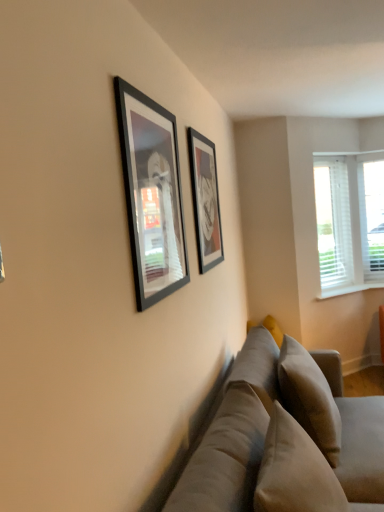
What is the approximate width of matte black picture frame at upper center, which appears as the first picture frame when viewed from the front?

matte black picture frame at upper center, which appears as the first picture frame when viewed from the front, is 1.27 inches wide.

The image size is (384, 512). Find the location of `white plastic blinds at right`. white plastic blinds at right is located at coordinates (333, 223).

Locate an element on the screen. This screenshot has width=384, height=512. soft beige pillow at lower right is located at coordinates coord(309,398).

In order to face soft beige pillow at lower right, should I rotate leftwards or rightwards?

To face it directly, rotate right by 15.220 degrees.

Where is `matte black picture frame at upper center, the 2th picture frame from the right`? This screenshot has height=512, width=384. matte black picture frame at upper center, the 2th picture frame from the right is located at coordinates (152, 194).

Is matte black picture frame at center, which is counted as the first picture frame, starting from the back, shorter than soft beige pillow at lower right?

No, matte black picture frame at center, which is counted as the first picture frame, starting from the back, is not shorter than soft beige pillow at lower right.

Can you confirm if matte black picture frame at center, the 2th picture frame positioned from the front, is wider than soft beige pillow at lower right?

Incorrect, the width of matte black picture frame at center, the 2th picture frame positioned from the front, does not surpass that of soft beige pillow at lower right.

Locate an element on the screen. This screenshot has height=512, width=384. pillow on the right of matte black picture frame at center, which is the 2th picture frame in left-to-right order is located at coordinates (309, 398).

Is matte black picture frame at upper center, which ranks as the 2th picture frame in back-to-front order, at the back of soft beige pillow at lower right?

soft beige pillow at lower right is not turned away from matte black picture frame at upper center, which ranks as the 2th picture frame in back-to-front order.

Considering the relative positions of soft beige pillow at lower right and matte black picture frame at upper center, the 2th picture frame from the right, in the image provided, is soft beige pillow at lower right to the left of matte black picture frame at upper center, the 2th picture frame from the right, from the viewer's perspective?

Incorrect, soft beige pillow at lower right is not on the left side of matte black picture frame at upper center, the 2th picture frame from the right.

From a real-world perspective, between soft beige pillow at lower right and matte black picture frame at upper center, which appears as the first picture frame when viewed from the front, who is vertically lower?

From a 3D spatial view, soft beige pillow at lower right is below.

Is soft beige pillow at lower right outside of matte black picture frame at upper center, which ranks as the 2th picture frame in back-to-front order?

Yes, soft beige pillow at lower right is located beyond the bounds of matte black picture frame at upper center, which ranks as the 2th picture frame in back-to-front order.

Is soft beige fabric couch at lower right inside the boundaries of white plastic window sill at right, or outside?

soft beige fabric couch at lower right is outside white plastic window sill at right.

From the picture: Considering the sizes of objects soft beige fabric couch at lower right and white plastic window sill at right in the image provided, who is thinner, soft beige fabric couch at lower right or white plastic window sill at right?

white plastic window sill at right is thinner.

From a real-world perspective, is soft beige fabric couch at lower right beneath white plastic window sill at right?

Yes, from a real-world perspective, soft beige fabric couch at lower right is under white plastic window sill at right.

In order to click on studio couch on the left of white plastic window sill at right in this screenshot , I will do point(286,438).

Is white plastic blinds at right inside the boundaries of soft beige fabric couch at lower right, or outside?

white plastic blinds at right is located beyond the bounds of soft beige fabric couch at lower right.

Would you say white plastic blinds at right is a long distance from soft beige fabric couch at lower right?

Yes, white plastic blinds at right and soft beige fabric couch at lower right are quite far apart.

Who is taller, white plastic blinds at right or soft beige fabric couch at lower right?

white plastic blinds at right.

Between white plastic blinds at right and soft beige fabric couch at lower right, which one appears on the right side from the viewer's perspective?

white plastic blinds at right.

Considering the positions of objects white plastic window sill at right and white plastic blinds at right in the image provided, who is in front, white plastic window sill at right or white plastic blinds at right?

white plastic window sill at right is closer to the camera.

Could you tell me if white plastic window sill at right is facing white plastic blinds at right?

No, white plastic window sill at right does not turn towards white plastic blinds at right.

Where is `window screen that is above the white plastic window sill at right (from the image's perspective)`? window screen that is above the white plastic window sill at right (from the image's perspective) is located at coordinates (333, 223).

Considering the positions of points (317, 197) and (294, 340), is point (317, 197) farther from camera compared to point (294, 340)?

Yes.

You are a GUI agent. You are given a task and a screenshot of the screen. Output one action in this format:
    pyautogui.click(x=<x>, y=<y>)
    Task: Click on the window screen above the soft beige pillow at lower right (from the image's perspective)
    The width and height of the screenshot is (384, 512).
    Given the screenshot: What is the action you would take?
    pyautogui.click(x=333, y=223)

Would you say white plastic blinds at right is outside soft beige pillow at lower right?

Yes, white plastic blinds at right is outside of soft beige pillow at lower right.

Considering the relative positions of white plastic blinds at right and soft beige pillow at lower right in the image provided, is white plastic blinds at right to the right of soft beige pillow at lower right from the viewer's perspective?

Yes.

Does soft beige pillow at lower right have a smaller size compared to matte black picture frame at center, which is the 2th picture frame in left-to-right order?

Actually, soft beige pillow at lower right might be larger than matte black picture frame at center, which is the 2th picture frame in left-to-right order.

Based on the photo, is soft beige pillow at lower right wider or thinner than matte black picture frame at center, arranged as the 1th picture frame when viewed from the right?

soft beige pillow at lower right is wider than matte black picture frame at center, arranged as the 1th picture frame when viewed from the right.

Can we say soft beige pillow at lower right lies outside matte black picture frame at center, arranged as the 1th picture frame when viewed from the right?

That's correct, soft beige pillow at lower right is outside of matte black picture frame at center, arranged as the 1th picture frame when viewed from the right.

Locate an element on the screen. The image size is (384, 512). pillow located in front of the matte black picture frame at center, which is counted as the first picture frame, starting from the back is located at coordinates (309, 398).

This screenshot has height=512, width=384. Identify the location of pillow below the matte black picture frame at upper center, which appears as the first picture frame when viewed from the front (from a real-world perspective). (309, 398).

Estimate the real-world distances between objects in this image. Which object is closer to white plastic window sill at right, soft beige fabric couch at lower right or white plastic blinds at right?

Among the two, white plastic blinds at right is located nearer to white plastic window sill at right.

Estimate the real-world distances between objects in this image. Which object is further from matte black picture frame at center, which is the 2th picture frame in left-to-right order, white plastic blinds at right or matte black picture frame at upper center, the 2th picture frame from the right?

white plastic blinds at right.

Considering their positions, is matte black picture frame at center, arranged as the 1th picture frame when viewed from the right, positioned closer to white plastic window sill at right than matte black picture frame at upper center, which is the 1th picture frame in left-to-right order?

The object closer to white plastic window sill at right is matte black picture frame at center, arranged as the 1th picture frame when viewed from the right.

Looking at the image, which one is located closer to white plastic window sill at right, soft beige fabric couch at lower right or soft beige pillow at lower right?

soft beige pillow at lower right is closer to white plastic window sill at right.

When comparing their distances from matte black picture frame at upper center, which appears as the first picture frame when viewed from the front, does soft beige pillow at lower right or white plastic blinds at right seem closer?

soft beige pillow at lower right.

Based on their spatial positions, is soft beige fabric couch at lower right or white plastic window sill at right further from white plastic blinds at right?

Based on the image, soft beige fabric couch at lower right appears to be further to white plastic blinds at right.

Looking at the image, which one is located closer to soft beige fabric couch at lower right, soft beige pillow at lower right or white plastic blinds at right?

soft beige pillow at lower right.

Looking at the image, which one is located further to white plastic window sill at right, matte black picture frame at upper center, which appears as the first picture frame when viewed from the front, or soft beige pillow at lower right?

matte black picture frame at upper center, which appears as the first picture frame when viewed from the front.

The image size is (384, 512). Identify the location of picture frame located between soft beige pillow at lower right and white plastic window sill at right in the depth direction. (205, 200).

What are the coordinates of `picture frame between matte black picture frame at center, the 2th picture frame positioned from the front, and soft beige fabric couch at lower right from top to bottom` in the screenshot? It's located at (152, 194).

The height and width of the screenshot is (512, 384). What are the coordinates of `pillow between matte black picture frame at upper center, which is the 1th picture frame in left-to-right order, and white plastic blinds at right from front to back` in the screenshot? It's located at (309, 398).

Locate an element on the screen. The image size is (384, 512). picture frame between matte black picture frame at upper center, which ranks as the 2th picture frame in back-to-front order, and white plastic window sill at right, along the z-axis is located at coordinates (205, 200).